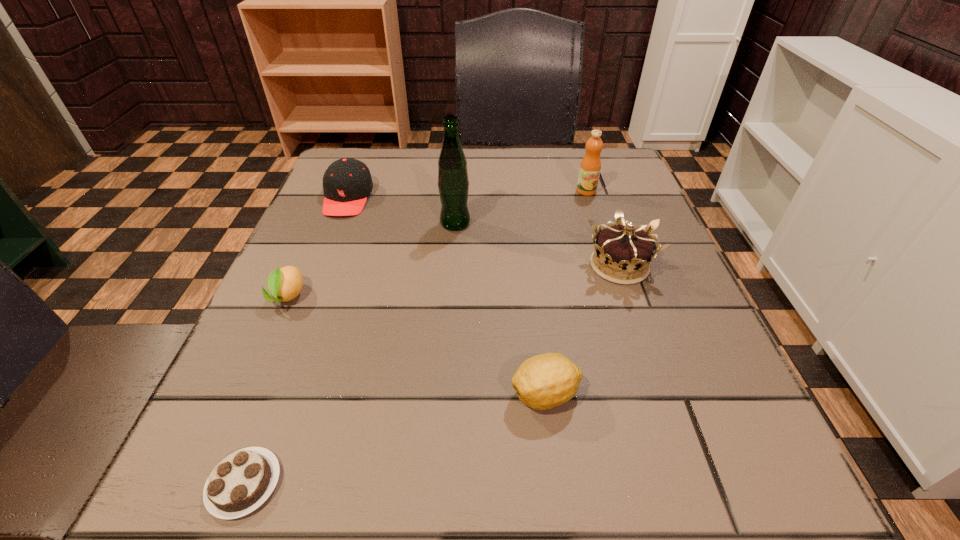
Locate an element on the screen. The width and height of the screenshot is (960, 540). orange juice that is at the far edge is located at coordinates (590, 167).

Locate an element on the screen. The image size is (960, 540). cap located in the far edge section of the desktop is located at coordinates (347, 182).

The image size is (960, 540). Identify the location of object at the near edge. (239, 484).

Where is `cap located in the left edge section of the desktop`? Image resolution: width=960 pixels, height=540 pixels. cap located in the left edge section of the desktop is located at coordinates (347, 182).

This screenshot has width=960, height=540. I want to click on lemon at the left edge, so click(x=285, y=284).

Identify the location of chocolate cake that is at the left edge. Image resolution: width=960 pixels, height=540 pixels. (239, 484).

Locate an element on the screen. This screenshot has height=540, width=960. orange juice located at the right edge is located at coordinates (590, 167).

Image resolution: width=960 pixels, height=540 pixels. In order to click on crown at the right edge in this screenshot , I will do `click(620, 249)`.

Identify the location of object at the far left corner. (347, 182).

Where is `object that is at the near left corner`? The height and width of the screenshot is (540, 960). object that is at the near left corner is located at coordinates (239, 484).